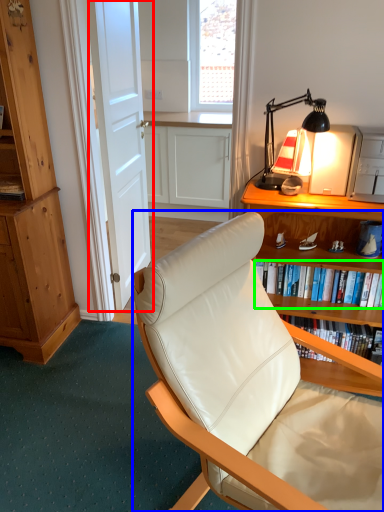
Question: Based on their relative distances, which object is farther from door (highlighted by a red box)? Choose from chair (highlighted by a blue box) and book (highlighted by a green box).

Choices:
 (A) chair
 (B) book

Answer: (A)